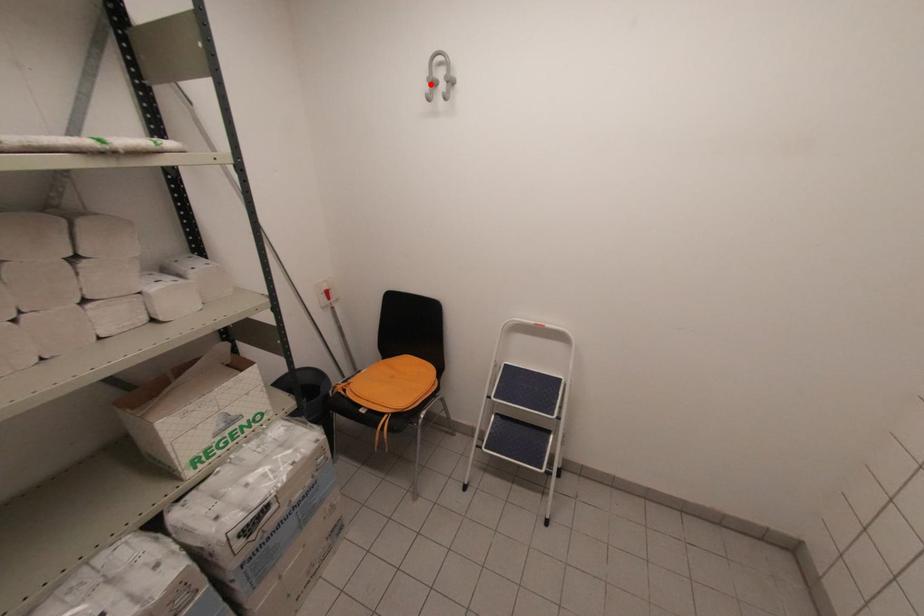
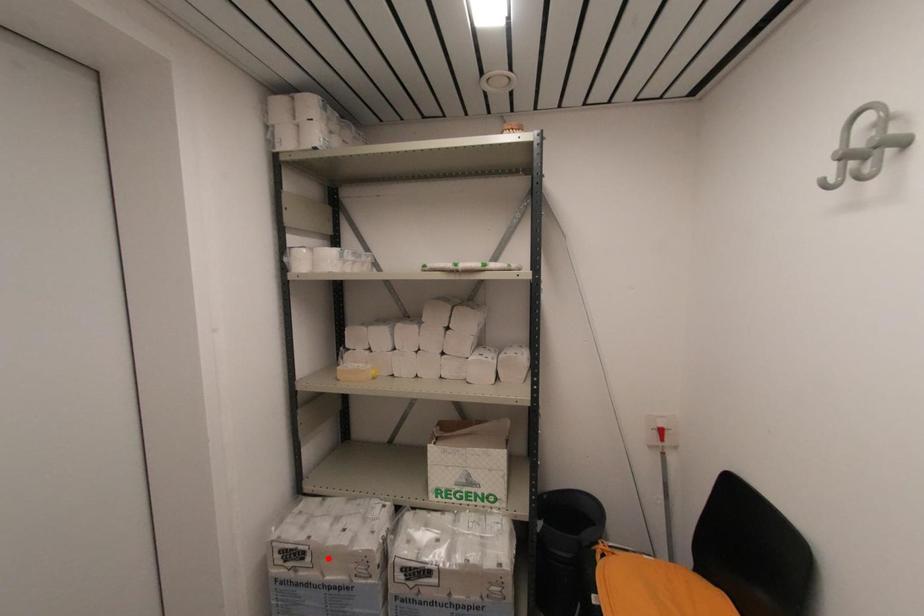
I am providing you with two images of the same scene from different viewpoints. A red point is marked on the first image and another point is marked on the second image. Do the highlighted points in image1 and image2 indicate the same real-world spot?

No